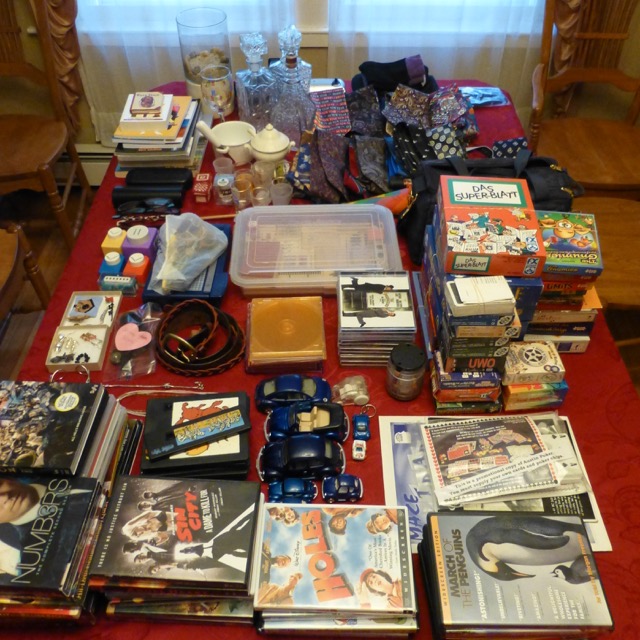
Locate an element on the screen. This screenshot has height=640, width=640. chairs is located at coordinates (586, 148), (612, 223), (45, 145), (9, 253).